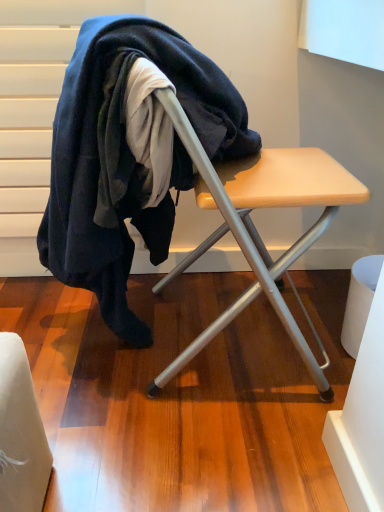
Question: From their relative heights in the image, would you say wooden table at center is taller or shorter than dark blue wool at center?

Choices:
 (A) tall
 (B) short

Answer: (B)

Question: Is wooden table at center bigger or smaller than dark blue wool at center?

Choices:
 (A) small
 (B) big

Answer: (A)

Question: From the image's perspective, relative to dark blue wool at center, is wooden table at center above or below?

Choices:
 (A) below
 (B) above

Answer: (A)

Question: Is dark blue wool at center taller or shorter than wooden table at center?

Choices:
 (A) tall
 (B) short

Answer: (A)

Question: Considering the relative positions of dark blue wool at center and wooden table at center in the image provided, is dark blue wool at center to the left or to the right of wooden table at center?

Choices:
 (A) left
 (B) right

Answer: (A)

Question: Considering the positions of point (132, 47) and point (274, 166), is point (132, 47) closer or farther from the camera than point (274, 166)?

Choices:
 (A) closer
 (B) farther

Answer: (A)

Question: Would you say dark blue wool at center is inside or outside wooden table at center?

Choices:
 (A) outside
 (B) inside

Answer: (B)